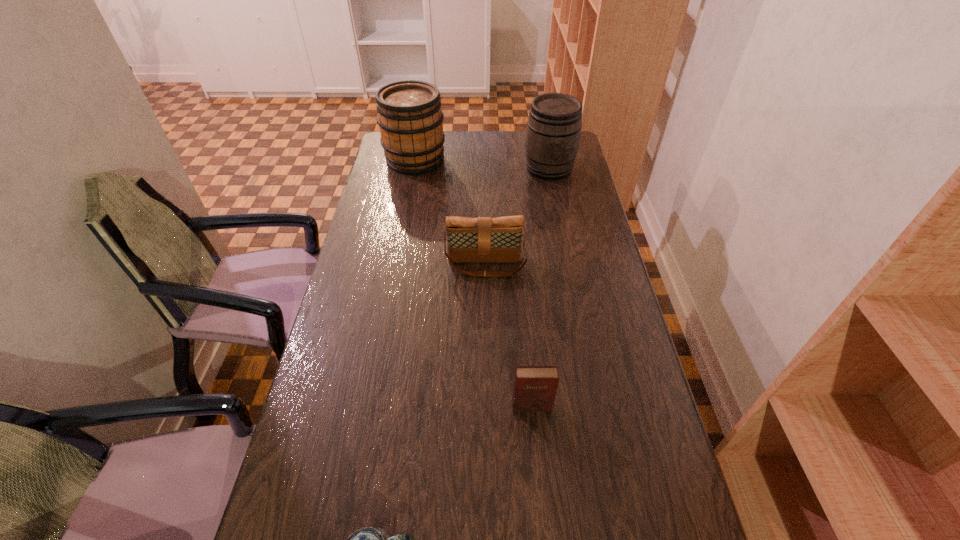
Identify the location of empty location between the rightmost object and the cider. (482, 164).

I want to click on unoccupied area between the wine bucket and the cider, so click(482, 164).

Locate an element on the screen. The height and width of the screenshot is (540, 960). unoccupied area between the shoulder bag and the cider is located at coordinates (450, 213).

This screenshot has height=540, width=960. What are the coordinates of `free space between the cider and the wine bucket` in the screenshot? It's located at (482, 164).

Locate an element on the screen. The height and width of the screenshot is (540, 960). blank region between the fourth tallest object and the third nearest object is located at coordinates (509, 336).

I want to click on object that is the fourth nearest to the second nearest object, so click(x=411, y=122).

Choose which object is the nearest neighbor to the shoulder bag. Please provide its 2D coordinates. Your answer should be formatted as a tuple, i.e. [(x, y)], where the tuple contains the x and y coordinates of a point satisfying the conditions above.

[(553, 132)]